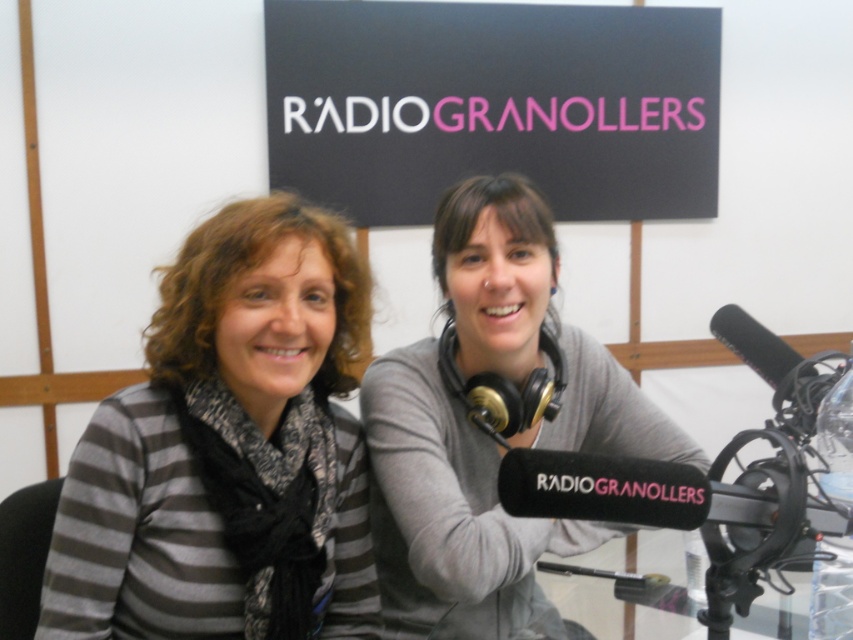
You are a technician in a radio studio. You need to adjust the angle of the black matte microphone at right so it faces the host seated in front of the black matte signboard at upper center. Can you do this without moving the microphone stand?

The black matte microphone at right is behind the black matte signboard at upper center, so you cannot adjust its angle to face the host in front of the signboard without moving the microphone stand.

You are a photographer setting up for a photo shoot in the studio. You need to place a light source to the right of the black matte microphone at lower right. Will this light source also be to the right of the striped fabric shirt at left?

The striped fabric shirt at left is to the left of the black matte microphone at lower right. Therefore, placing the light source to the right of the black matte microphone at lower right would also place it to the right of the striped fabric shirt at left.

You are a photographer setting up for a radio show. You notice the striped fabric shirt at left and the black matte microphone at lower right. Which object is smaller in size?

The striped fabric shirt at left has a smaller size compared to the black matte microphone at lower right, so the striped fabric shirt at left is smaller.